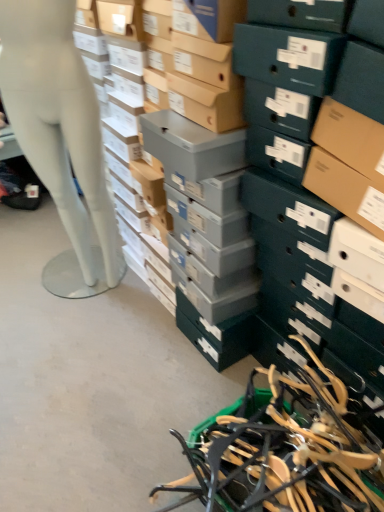
At what (x,y) coordinates should I click in order to perform the action: click on free space in front of matte white mannequin at left. Please return your answer as a coordinate pair (x, y). The width and height of the screenshot is (384, 512). Looking at the image, I should click on coord(81,335).